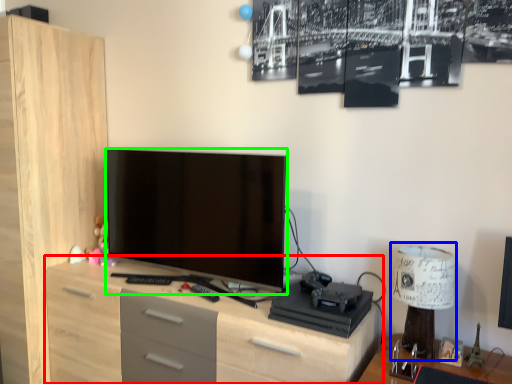
Question: Which is farther away from chest of drawers (highlighted by a red box)? table lamp (highlighted by a blue box) or television (highlighted by a green box)?

Choices:
 (A) table lamp
 (B) television

Answer: (A)